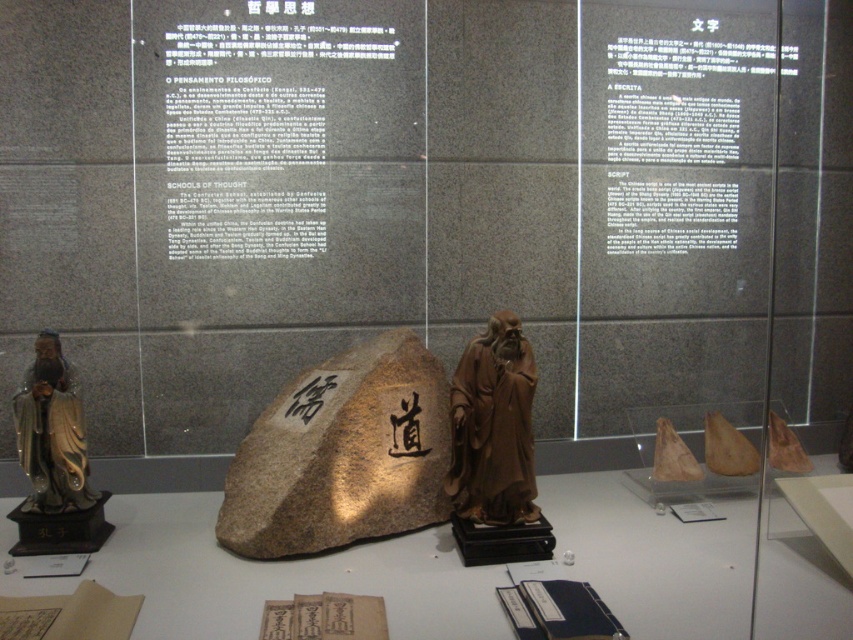
You are a visitor standing in front of the display case in the museum. You notice two points marked inside the case. The first point is at coordinates point [506,428] and the second is at point [45,513]. Which of these points is nearer to you?

Point [506,428] is closer to the viewer than point [45,513].

You are a tour guide explaining the display case to visitors. You want to point out the location of the brown wooden statue at center relative to the gold lacquered statue at left. How would you describe its position?

The brown wooden statue at center is located to the right of the gold lacquered statue at left.

You are standing in front of a museum display case that has a point marked at coordinates [434,388]. The display case is 3 meters tall. Can you reach the point without using a ladder?

The point at [434,388] is 2.96 meters from the camera, which is almost exactly the height of the display case. Since the display case is 3 meters tall, the point is just slightly below the top. However, reaching 2.96 meters without a ladder would be extremely difficult for most people, as average human reach without assistance is around 2 meters. Therefore, you likely cannot reach the point without a ladder.